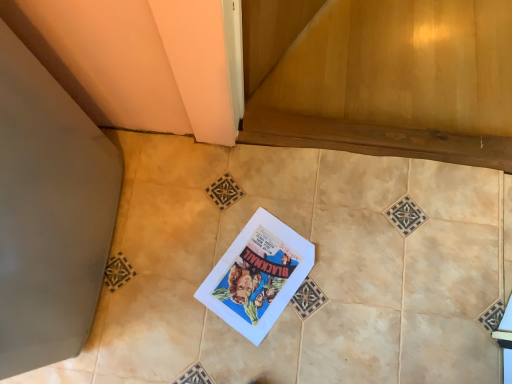
This screenshot has height=384, width=512. I want to click on free space in front of matte paper comic book at center, so click(x=257, y=353).